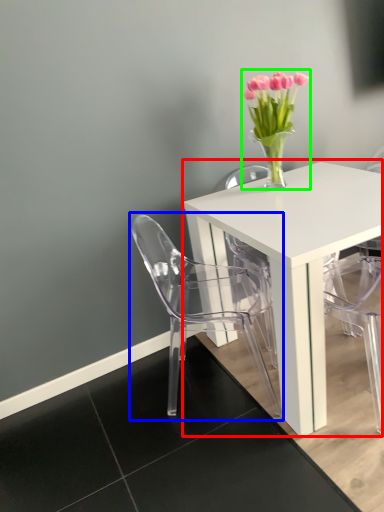
Question: Which object is positioned closest to table (highlighted by a red box)? Select from chair (highlighted by a blue box) and floral arrangement (highlighted by a green box).

Choices:
 (A) chair
 (B) floral arrangement

Answer: (A)